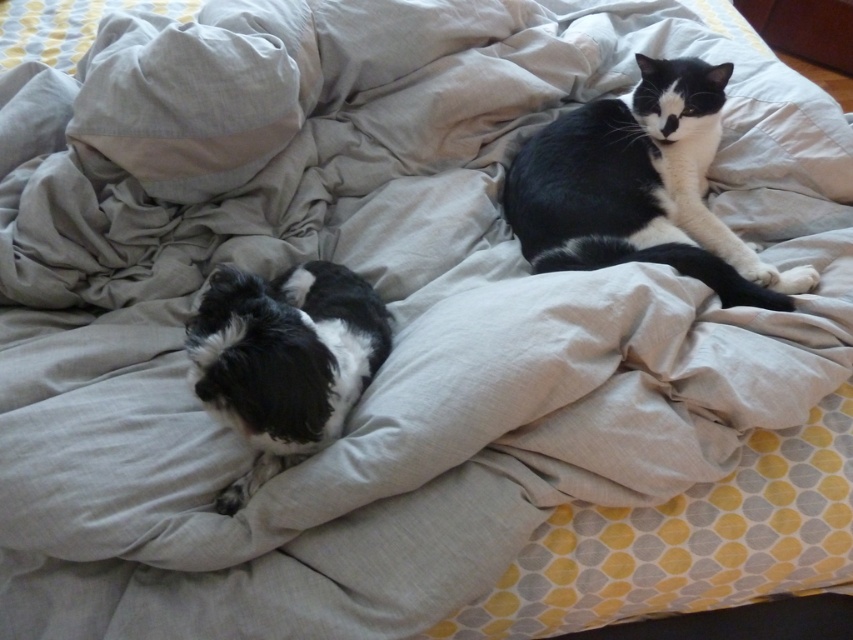
Does black and white fur cat at upper right have a greater height compared to fluffy black-and-white dog at lower left?

Yes, black and white fur cat at upper right is taller than fluffy black-and-white dog at lower left.

This screenshot has height=640, width=853. Find the location of `black and white fur cat at upper right`. black and white fur cat at upper right is located at coordinates (640, 188).

Locate an element on the screen. Image resolution: width=853 pixels, height=640 pixels. black and white fur cat at upper right is located at coordinates (640, 188).